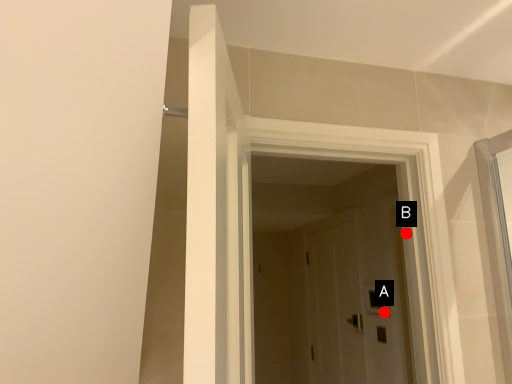
Question: Two points are circled on the image, labeled by A and B beside each circle. Which of the following is the closest to the observer?

Choices:
 (A) A is closer
 (B) B is closer

Answer: (B)